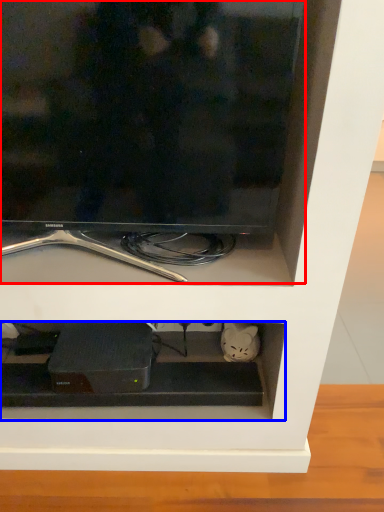
Question: Which object is further to the camera taking this photo, television (highlighted by a red box) or cabinet (highlighted by a blue box)?

Choices:
 (A) television
 (B) cabinet

Answer: (B)